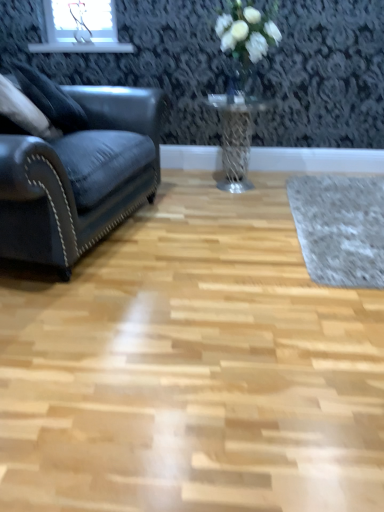
At what (x,y) coordinates should I click in order to perform the action: click on vacant area situated below metallic mesh table at center (from a real-world perspective). Please return your answer as a coordinate pair (x, y). Looking at the image, I should click on (222, 189).